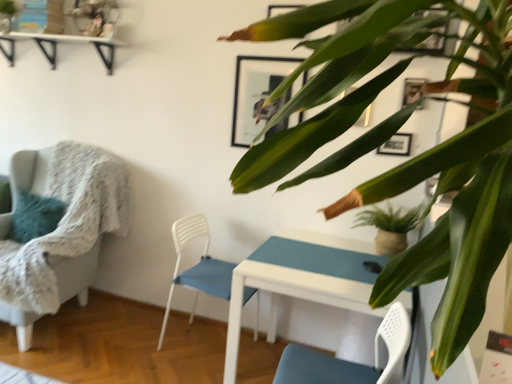
How much space does white plastic chair at center, marked as the second chair in a left-to-right arrangement, occupy vertically?

white plastic chair at center, marked as the second chair in a left-to-right arrangement, is 30.88 inches tall.

Find the location of a particular element. Image resolution: width=512 pixels, height=384 pixels. green matte houseplant at center, which is counted as the 1th houseplant, starting from the right is located at coordinates (390, 227).

Find the location of `green glossy leafy plant at upper right, the second houseplant from the right`. green glossy leafy plant at upper right, the second houseplant from the right is located at coordinates (425, 151).

Measure the distance between green glossy leafy plant at upper right, positioned as the first houseplant in left-to-right order, and camera.

The depth of green glossy leafy plant at upper right, positioned as the first houseplant in left-to-right order, is 32.60 centimeters.

What is the approximate width of white glossy table at center?

The width of white glossy table at center is 80.75 centimeters.

Image resolution: width=512 pixels, height=384 pixels. Describe the element at coordinates (76, 209) in the screenshot. I see `textured gray armchair at left, which appears as the first chair when viewed from the left` at that location.

Where is `matte black picture frame at upper center`? matte black picture frame at upper center is located at coordinates (258, 93).

The width and height of the screenshot is (512, 384). What do you see at coordinates (258, 93) in the screenshot?
I see `matte black picture frame at upper center` at bounding box center [258, 93].

Where is `white plastic chair at center, positioned as the 1th chair in right-to-left order`? white plastic chair at center, positioned as the 1th chair in right-to-left order is located at coordinates (197, 267).

Can you confirm if matte black picture frame at upper center is smaller than white plastic chair at center, marked as the second chair in a left-to-right arrangement?

Yes.

How many degrees apart are the facing directions of matte black picture frame at upper center and white plastic chair at center, marked as the second chair in a left-to-right arrangement?

They differ by 89.6 degrees in their facing directions.

Does matte black picture frame at upper center touch white plastic chair at center, marked as the second chair in a left-to-right arrangement?

matte black picture frame at upper center and white plastic chair at center, marked as the second chair in a left-to-right arrangement, are clearly separated.

Considering the sizes of matte black picture frame at upper center and white plastic chair at center, positioned as the 1th chair in right-to-left order, in the image, is matte black picture frame at upper center wider or thinner than white plastic chair at center, positioned as the 1th chair in right-to-left order,?

Clearly, matte black picture frame at upper center has less width compared to white plastic chair at center, positioned as the 1th chair in right-to-left order.

From the image's perspective, relative to green glossy leafy plant at upper right, which appears as the first houseplant when viewed from the front, is matte black picture frame at upper center above or below?

From the image's perspective, matte black picture frame at upper center appears above green glossy leafy plant at upper right, which appears as the first houseplant when viewed from the front.

Does matte black picture frame at upper center lie in front of green glossy leafy plant at upper right, the second houseplant from the right?

No, the depth of matte black picture frame at upper center is greater than that of green glossy leafy plant at upper right, the second houseplant from the right.

Is matte black picture frame at upper center not near green glossy leafy plant at upper right, which is counted as the second houseplant, starting from the back?

Yes, matte black picture frame at upper center and green glossy leafy plant at upper right, which is counted as the second houseplant, starting from the back, are located far from each other.

How far apart are matte black picture frame at upper center and green glossy leafy plant at upper right, positioned as the first houseplant in left-to-right order?

matte black picture frame at upper center and green glossy leafy plant at upper right, positioned as the first houseplant in left-to-right order, are 4.55 feet apart.

Is green matte houseplant at center, which is the first houseplant in back-to-front order, looking in the opposite direction of green glossy leafy plant at upper right, the second houseplant from the right?

That's not correct — green matte houseplant at center, which is the first houseplant in back-to-front order, is not looking away from green glossy leafy plant at upper right, the second houseplant from the right.

Is point (384, 218) closer or farther from the camera than point (276, 98)?

Clearly, point (384, 218) is more distant from the camera than point (276, 98).

Image resolution: width=512 pixels, height=384 pixels. Identify the location of houseplant behind the green glossy leafy plant at upper right, positioned as the first houseplant in left-to-right order. (390, 227).

Which of these two, green matte houseplant at center, which is the first houseplant in back-to-front order, or green glossy leafy plant at upper right, which is counted as the second houseplant, starting from the back, is thinner?

Thinner between the two is green matte houseplant at center, which is the first houseplant in back-to-front order.

Can you confirm if green glossy leafy plant at upper right, which is counted as the second houseplant, starting from the back, is wider than matte black picture frame at upper center?

Yes, green glossy leafy plant at upper right, which is counted as the second houseplant, starting from the back, is wider than matte black picture frame at upper center.

Could you tell me if green glossy leafy plant at upper right, which is counted as the second houseplant, starting from the back, is facing matte black picture frame at upper center?

No, green glossy leafy plant at upper right, which is counted as the second houseplant, starting from the back, is not aimed at matte black picture frame at upper center.

Consider the image. Which object is more forward, green glossy leafy plant at upper right, the second houseplant from the right, or matte black picture frame at upper center?

green glossy leafy plant at upper right, the second houseplant from the right.

Is there a large distance between green glossy leafy plant at upper right, positioned as the first houseplant in left-to-right order, and matte black picture frame at upper center?

Yes, green glossy leafy plant at upper right, positioned as the first houseplant in left-to-right order, is far from matte black picture frame at upper center.

Between textured gray armchair at left, which appears as the second chair when viewed from the right, and white plastic chair at center, marked as the second chair in a left-to-right arrangement, which one appears on the right side from the viewer's perspective?

From the viewer's perspective, white plastic chair at center, marked as the second chair in a left-to-right arrangement, appears more on the right side.

In the scene shown: Between textured gray armchair at left, which appears as the second chair when viewed from the right, and white plastic chair at center, marked as the second chair in a left-to-right arrangement, which one has less height?

white plastic chair at center, marked as the second chair in a left-to-right arrangement.

Is textured gray armchair at left, which appears as the second chair when viewed from the right, with white plastic chair at center, marked as the second chair in a left-to-right arrangement?

textured gray armchair at left, which appears as the second chair when viewed from the right, and white plastic chair at center, marked as the second chair in a left-to-right arrangement, are clearly separated.

Is textured gray armchair at left, which appears as the second chair when viewed from the right, not within white glossy table at center?

textured gray armchair at left, which appears as the second chair when viewed from the right, is positioned outside white glossy table at center.

From a real-world perspective, between textured gray armchair at left, which appears as the first chair when viewed from the left, and white glossy table at center, who is vertically higher?

textured gray armchair at left, which appears as the first chair when viewed from the left, is physically above.

Would you say textured gray armchair at left, which appears as the second chair when viewed from the right, is to the left or to the right of white glossy table at center in the picture?

From the image, it's evident that textured gray armchair at left, which appears as the second chair when viewed from the right, is to the left of white glossy table at center.

Where is `table below the textured gray armchair at left, which appears as the second chair when viewed from the right (from the image's perspective)`? The width and height of the screenshot is (512, 384). table below the textured gray armchair at left, which appears as the second chair when viewed from the right (from the image's perspective) is located at coordinates [x=301, y=280].

Is green matte houseplant at center, which is the first houseplant in back-to-front order, inside or outside of white glossy table at center?

green matte houseplant at center, which is the first houseplant in back-to-front order, is outside white glossy table at center.

Considering their positions, is green matte houseplant at center, marked as the second houseplant in a left-to-right arrangement, located in front of or behind white glossy table at center?

green matte houseplant at center, marked as the second houseplant in a left-to-right arrangement, is behind white glossy table at center.

Which object is positioned more to the left, green matte houseplant at center, the second houseplant when ordered from front to back, or white glossy table at center?

Positioned to the left is white glossy table at center.

How much distance is there between green matte houseplant at center, which is counted as the 1th houseplant, starting from the right, and white glossy table at center?

They are 15.56 inches apart.

Locate an element on the screen. the 2nd chair below the matte black picture frame at upper center (from the image's perspective) is located at coordinates (197, 267).

From a real-world perspective, which houseplant is the 1st one underneath the matte black picture frame at upper center? Please provide its 2D coordinates.

[(425, 151)]

Looking at the image, which one is located closer to white glossy table at center, green matte houseplant at center, which is counted as the 1th houseplant, starting from the right, or white plastic chair at center, marked as the second chair in a left-to-right arrangement?

green matte houseplant at center, which is counted as the 1th houseplant, starting from the right.

Based on the photo, from the image, which object appears to be nearer to green glossy leafy plant at upper right, which appears as the first houseplant when viewed from the front, white glossy table at center or matte black picture frame at upper center?

Among the two, white glossy table at center is located nearer to green glossy leafy plant at upper right, which appears as the first houseplant when viewed from the front.

Estimate the real-world distances between objects in this image. Which object is further from white glossy table at center, green matte houseplant at center, which is counted as the 1th houseplant, starting from the right, or green glossy leafy plant at upper right, which is counted as the second houseplant, starting from the back?

Based on the image, green glossy leafy plant at upper right, which is counted as the second houseplant, starting from the back, appears to be further to white glossy table at center.

Estimate the real-world distances between objects in this image. Which object is further from green matte houseplant at center, which is the first houseplant in back-to-front order, white glossy table at center or white plastic chair at center, marked as the second chair in a left-to-right arrangement?

white plastic chair at center, marked as the second chair in a left-to-right arrangement, lies further to green matte houseplant at center, which is the first houseplant in back-to-front order, than the other object.

Looking at the image, which one is located further to green matte houseplant at center, the second houseplant when ordered from front to back, green glossy leafy plant at upper right, which is counted as the second houseplant, starting from the back, or textured gray armchair at left, which appears as the first chair when viewed from the left?

textured gray armchair at left, which appears as the first chair when viewed from the left, lies further to green matte houseplant at center, the second houseplant when ordered from front to back, than the other object.

Estimate the real-world distances between objects in this image. Which object is closer to green glossy leafy plant at upper right, positioned as the first houseplant in left-to-right order, white plastic chair at center, positioned as the 1th chair in right-to-left order, or textured gray armchair at left, which appears as the second chair when viewed from the right?

white plastic chair at center, positioned as the 1th chair in right-to-left order, is positioned closer to the anchor green glossy leafy plant at upper right, positioned as the first houseplant in left-to-right order.

Estimate the real-world distances between objects in this image. Which object is further from matte black picture frame at upper center, white plastic chair at center, positioned as the 1th chair in right-to-left order, or green matte houseplant at center, which is counted as the 1th houseplant, starting from the right?

Among the two, green matte houseplant at center, which is counted as the 1th houseplant, starting from the right, is located further to matte black picture frame at upper center.

Consider the image. Estimate the real-world distances between objects in this image. Which object is further from white glossy table at center, green glossy leafy plant at upper right, the second houseplant from the right, or textured gray armchair at left, which appears as the first chair when viewed from the left?

Among the two, green glossy leafy plant at upper right, the second houseplant from the right, is located further to white glossy table at center.

What are the coordinates of `table between white plastic chair at center, positioned as the 1th chair in right-to-left order, and green matte houseplant at center, the second houseplant when ordered from front to back, in the horizontal direction` in the screenshot? It's located at (301, 280).

Locate an element on the screen. table between green glossy leafy plant at upper right, the second houseplant from the right, and textured gray armchair at left, which appears as the first chair when viewed from the left, along the z-axis is located at coordinates (x=301, y=280).

The image size is (512, 384). What are the coordinates of `table between green glossy leafy plant at upper right, positioned as the first houseplant in left-to-right order, and matte black picture frame at upper center in the front-back direction` in the screenshot? It's located at (301, 280).

The height and width of the screenshot is (384, 512). I want to click on chair situated between textured gray armchair at left, which appears as the second chair when viewed from the right, and matte black picture frame at upper center from left to right, so click(197, 267).